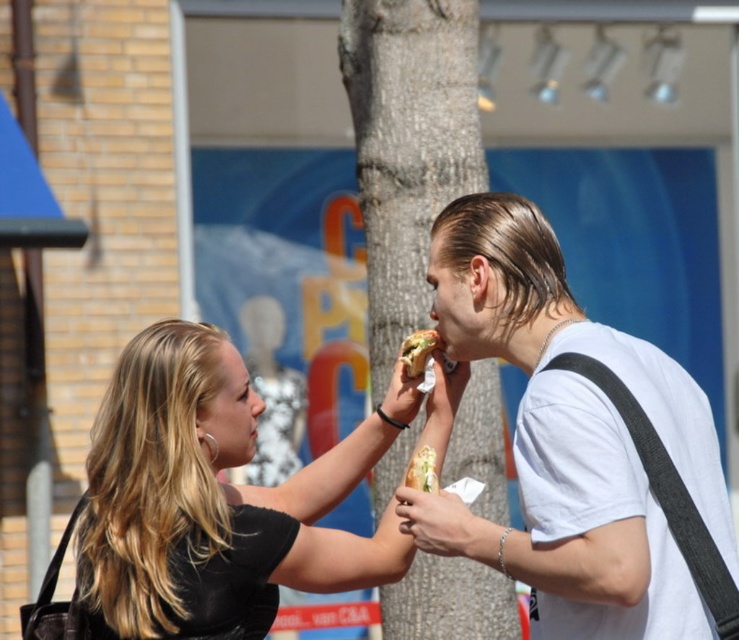
Who is more forward, (460, 419) or (423, 545)?

Positioned in front is point (423, 545).

Can you confirm if green textured tree trunk at center is bigger than smooth white hand at center?

Indeed, green textured tree trunk at center has a larger size compared to smooth white hand at center.

The image size is (739, 640). I want to click on green textured tree trunk at center, so click(406, 145).

The width and height of the screenshot is (739, 640). In order to click on green textured tree trunk at center in this screenshot , I will do `click(406, 145)`.

Does white matte shirt at right have a smaller size compared to white bread sandwich at center?

No.

Is point (638, 385) closer to camera compared to point (415, 465)?

That is True.

The width and height of the screenshot is (739, 640). Identify the location of white matte shirt at right. (576, 433).

Between shiny golden sandwich at center and white bread sandwich at center, which one appears on the left side from the viewer's perspective?

From the viewer's perspective, white bread sandwich at center appears more on the left side.

Is shiny golden sandwich at center closer to the viewer compared to white bread sandwich at center?

No, shiny golden sandwich at center is behind white bread sandwich at center.

Locate an element on the screen. shiny golden sandwich at center is located at coordinates (418, 352).

Where is `shiny golden sandwich at center`? This screenshot has width=739, height=640. shiny golden sandwich at center is located at coordinates (418, 352).